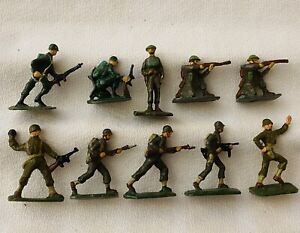
Find the location of a particular element. Image resolution: width=300 pixels, height=233 pixels. toy soldier green helmets is located at coordinates (51, 46), (113, 58), (151, 48), (195, 57), (253, 57), (267, 122), (219, 125), (167, 128), (109, 131), (36, 126).